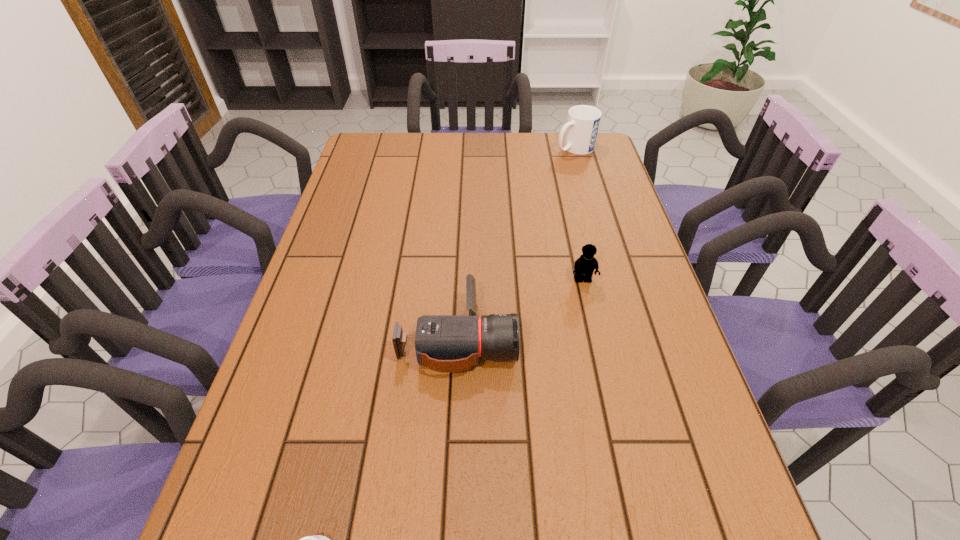
This screenshot has height=540, width=960. Find the location of `the farthest object`. the farthest object is located at coordinates (583, 121).

Identify the location of the second farthest object. (584, 266).

You are a GUI agent. You are given a task and a screenshot of the screen. Output one action in this format:
    pyautogui.click(x=<x>, y=<y>)
    Task: Click on the third object from right to left
    The image size is (960, 540).
    Given the screenshot: What is the action you would take?
    pyautogui.click(x=444, y=343)

Identify the location of the third farthest object. This screenshot has width=960, height=540. (444, 343).

Where is `free location located on the front of the mug`? free location located on the front of the mug is located at coordinates (590, 202).

You are a GUI agent. You are given a task and a screenshot of the screen. Output one action in this format:
    pyautogui.click(x=<x>, y=<y>)
    Task: Click on the free location located 0.350m on the front-facing side of the third nearest object
    This screenshot has width=960, height=540.
    Given the screenshot: What is the action you would take?
    pyautogui.click(x=612, y=411)

Locate an element on the screen. The width and height of the screenshot is (960, 540). vacant space positioned 0.090m on the lens of the camcorder is located at coordinates (553, 337).

Where is `object situated at the far edge`? This screenshot has width=960, height=540. object situated at the far edge is located at coordinates (583, 121).

At what (x,y) coordinates should I click in order to perform the action: click on mug that is positioned at the right edge. Please return your answer as a coordinate pair (x, y). This screenshot has width=960, height=540. Looking at the image, I should click on (583, 121).

Where is `Lego located in the right edge section of the desktop`? The height and width of the screenshot is (540, 960). Lego located in the right edge section of the desktop is located at coordinates (584, 266).